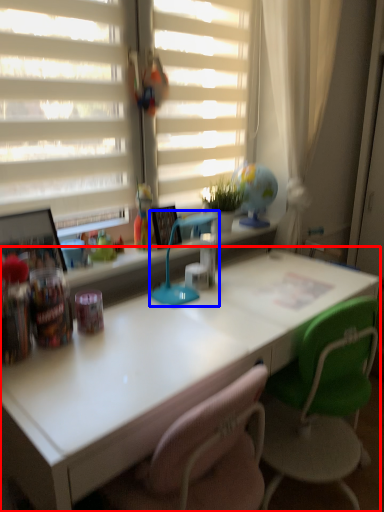
Question: Which object appears farthest to the camera in this image, desk (highlighted by a red box) or table lamp (highlighted by a blue box)?

Choices:
 (A) desk
 (B) table lamp

Answer: (B)